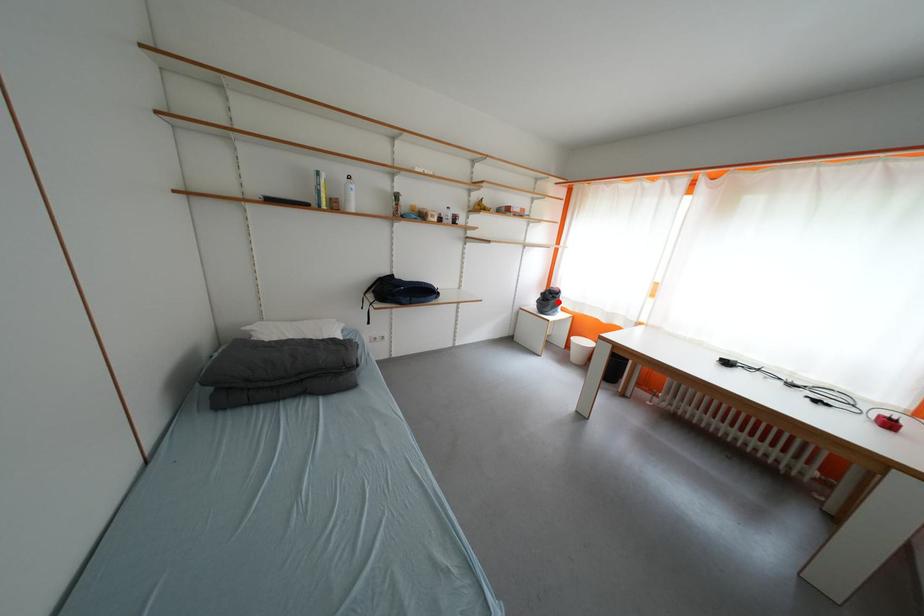
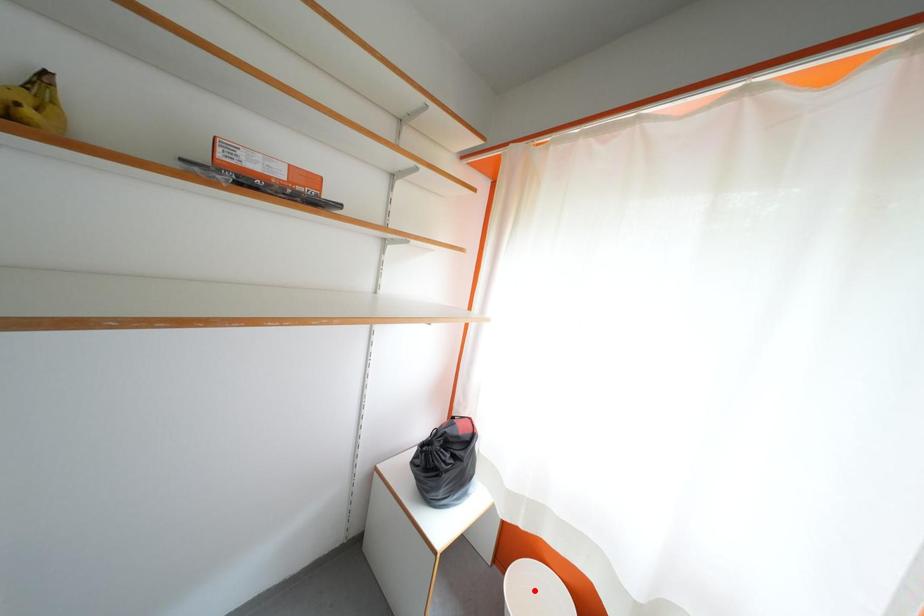
I am providing you with two images of the same scene from different viewpoints. A red point is marked on the first image and another point is marked on the second image. Is the marked point in image1 the same physical position as the marked point in image2?

No